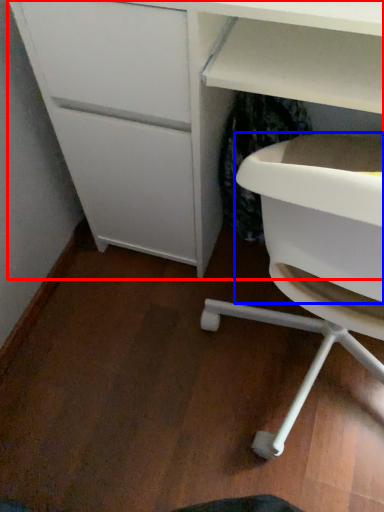
Question: Which of the following is the closest to the observer, desk (highlighted by a red box) or cabinetry (highlighted by a blue box)?

Choices:
 (A) desk
 (B) cabinetry

Answer: (B)